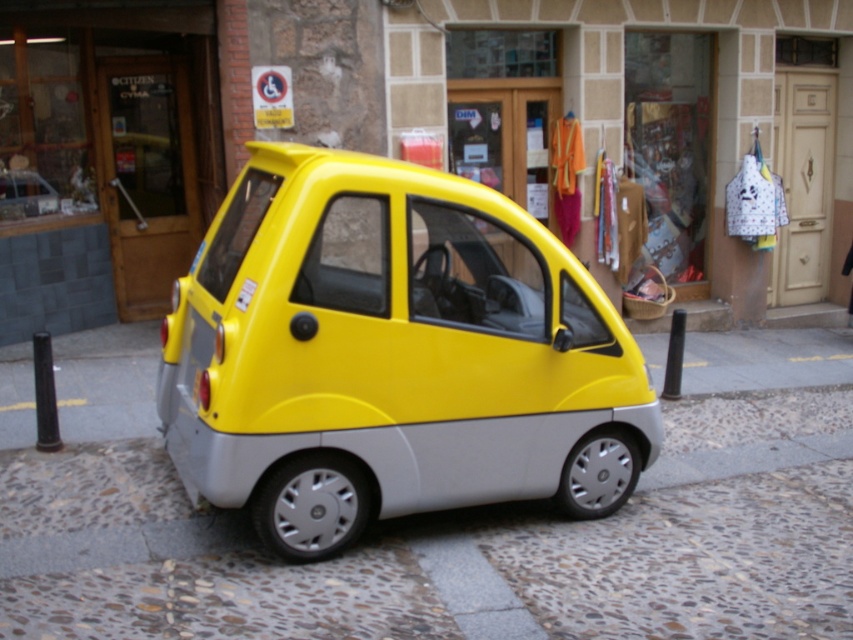
Who is more forward, (804,561) or (257,220)?

Positioned in front is point (257,220).

Identify the location of yellow matte pavement at lower center. This screenshot has width=853, height=640. (450, 524).

Who is higher up, yellow matte car at center or matte glass storefront at center?

matte glass storefront at center is higher up.

Which is below, yellow matte car at center or matte glass storefront at center?

yellow matte car at center

This screenshot has width=853, height=640. What do you see at coordinates (392, 355) in the screenshot?
I see `yellow matte car at center` at bounding box center [392, 355].

Where is `yellow matte car at center`? This screenshot has height=640, width=853. yellow matte car at center is located at coordinates (392, 355).

Is yellow matte pavement at lower center shorter than matte glass storefront at center?

Yes.

Between yellow matte pavement at lower center and matte glass storefront at center, which one is positioned higher?

Positioned higher is matte glass storefront at center.

Is point (254, 564) less distant than point (103, 304)?

Yes, it is in front of point (103, 304).

Find the location of a particular element. This screenshot has width=853, height=640. yellow matte pavement at lower center is located at coordinates (450, 524).